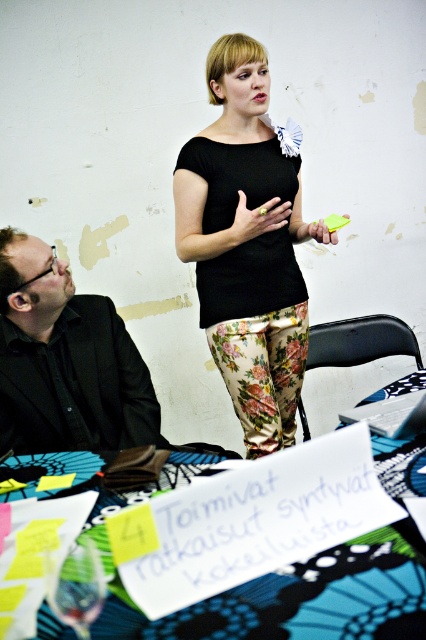
Is black matte shirt at center closer to camera compared to transparent glass at lower left?

No, it is not.

Does black matte shirt at center appear over transparent glass at lower left?

Correct, black matte shirt at center is located above transparent glass at lower left.

Does point (287, 260) lie in front of point (89, 541)?

That is False.

At what (x,y) coordinates should I click in order to perform the action: click on black matte shirt at center. Please return your answer as a coordinate pair (x, y). The height and width of the screenshot is (640, 426). Looking at the image, I should click on (247, 244).

I want to click on black shirt at left, so click(x=66, y=362).

Does point (32, 369) lie in front of point (74, 628)?

No, (32, 369) is further to viewer.

The image size is (426, 640). Describe the element at coordinates (66, 362) in the screenshot. I see `black shirt at left` at that location.

You are a GUI agent. You are given a task and a screenshot of the screen. Output one action in this format:
    pyautogui.click(x=<x>, y=<y>)
    Task: Click on the black shirt at left
    The width and height of the screenshot is (426, 640).
    Given the screenshot: What is the action you would take?
    pyautogui.click(x=66, y=362)

Which is more to the right, black matte shirt at center or black shirt at left?

From the viewer's perspective, black matte shirt at center appears more on the right side.

Is point (221, 60) closer to camera compared to point (94, 356)?

No.

The image size is (426, 640). I want to click on black matte shirt at center, so click(247, 244).